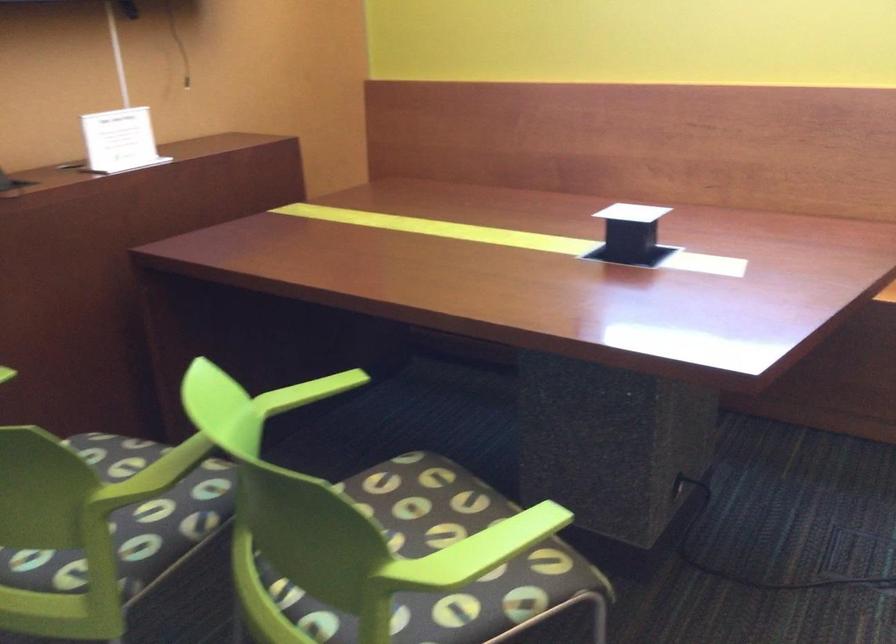
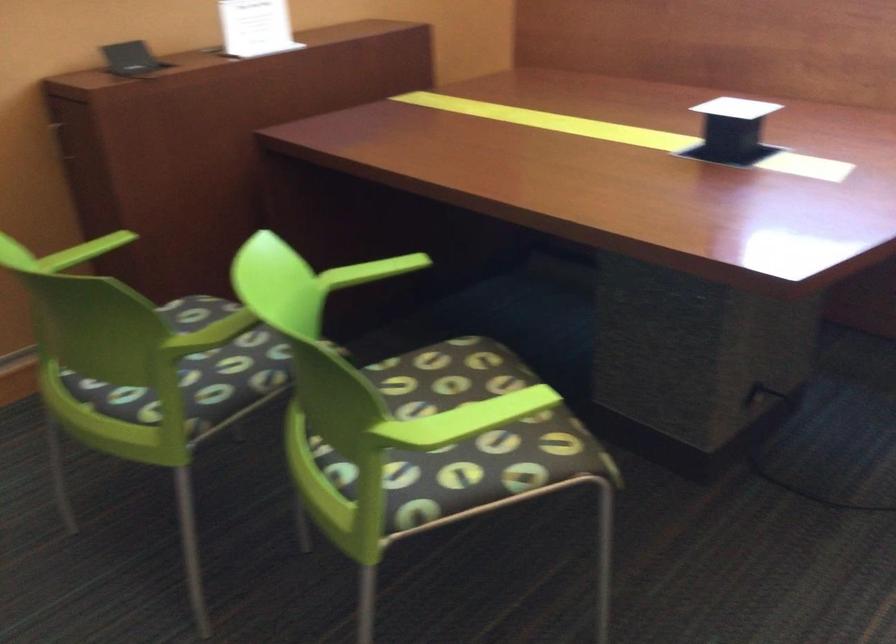
Question: How did the camera likely rotate?

Choices:
 (A) Left
 (B) Right
 (C) Up
 (D) Down

Answer: (A)